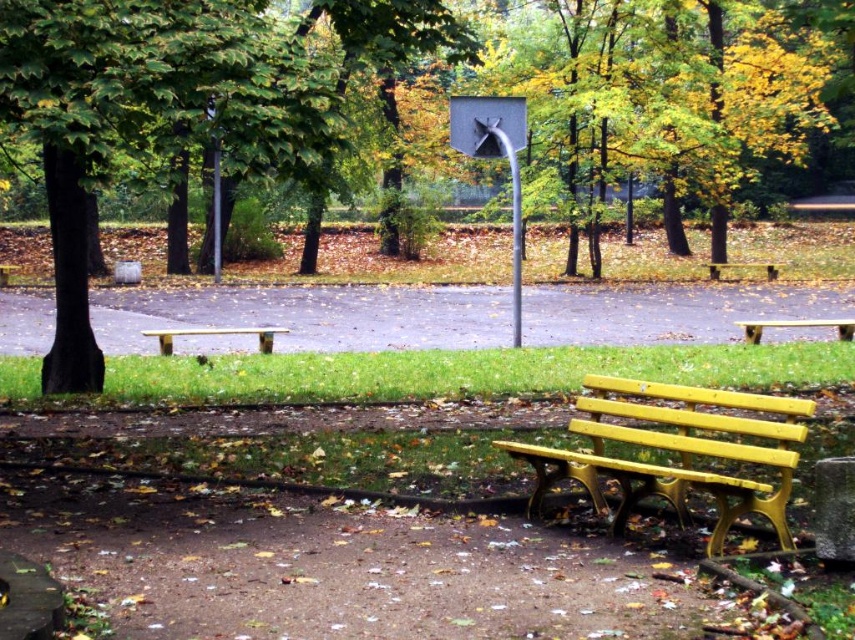
Which is more to the right, metallic gray basketball hoop at center or wooden bench at center?

Positioned to the right is metallic gray basketball hoop at center.

Does metallic gray basketball hoop at center have a greater width compared to wooden bench at center?

Correct, the width of metallic gray basketball hoop at center exceeds that of wooden bench at center.

Is point (478, 132) positioned before point (234, 326)?

That is True.

Identify the location of metallic gray basketball hoop at center. (494, 157).

Is point (809, 413) behind point (236, 333)?

No, it is not.

Can you confirm if yellow plastic bench at lower right is positioned to the left of wooden bench at center?

In fact, yellow plastic bench at lower right is to the right of wooden bench at center.

What do you see at coordinates (675, 451) in the screenshot? I see `yellow plastic bench at lower right` at bounding box center [675, 451].

Locate an element on the screen. The height and width of the screenshot is (640, 855). yellow plastic bench at lower right is located at coordinates (675, 451).

Does metallic gray basketball hoop at center have a greater width compared to yellow painted wood bench at right?

Yes.

Find the location of `metallic gray basketball hoop at center`. metallic gray basketball hoop at center is located at coordinates (494, 157).